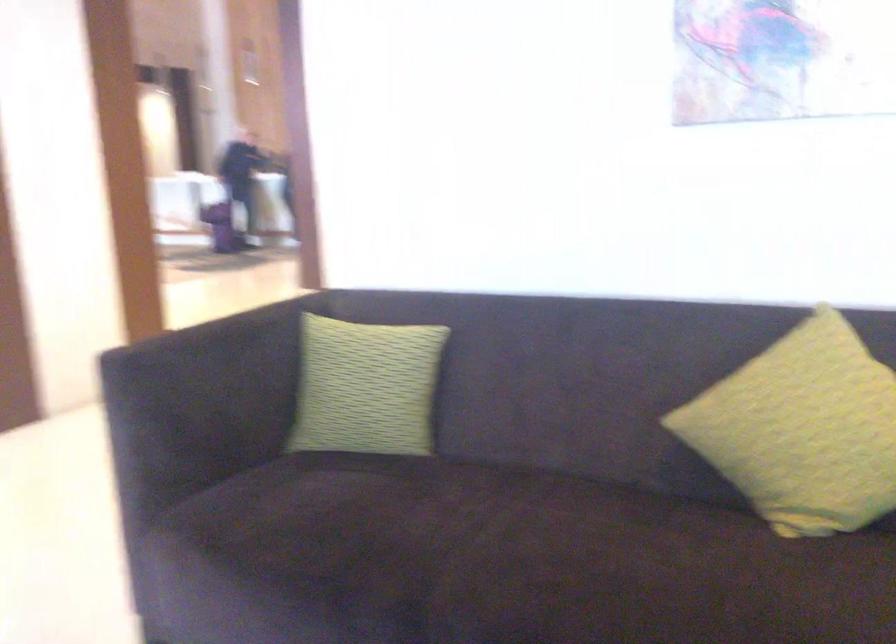
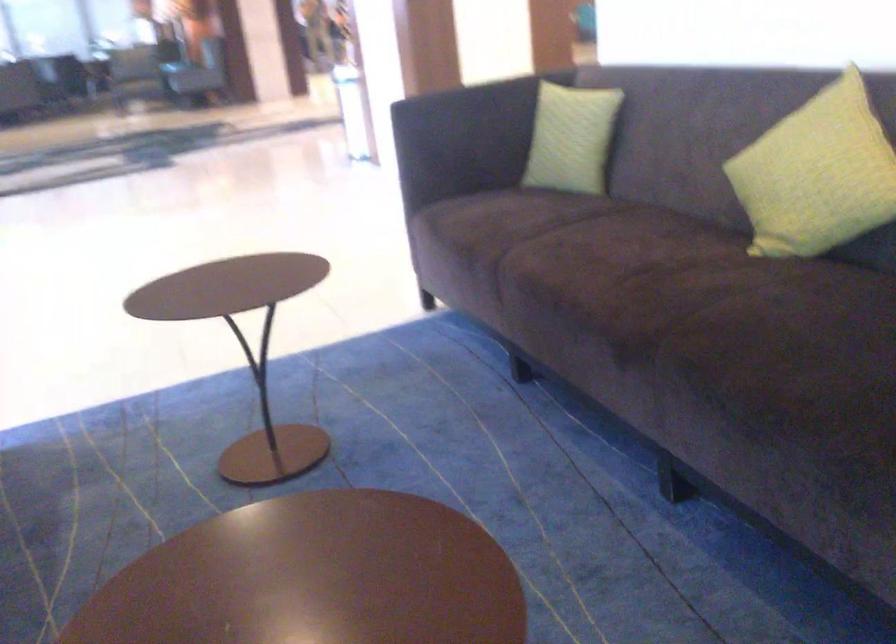
Where in the second image is the point corresponding to point (238, 354) from the first image?

(477, 106)